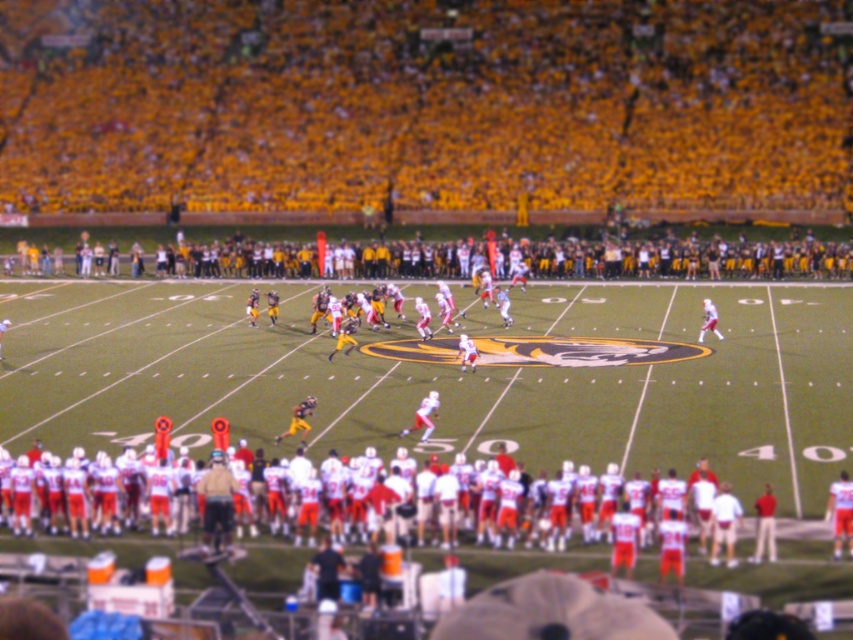
You are a photographer standing near the camera at upper right. You want to capture a close shot of the yellow fabric seats at upper center where the fans are cheering. Given that your camera has a maximum zoom range of 200 feet, will you be able to clearly capture the seats?

The yellow fabric seats at upper center and camera are 241.56 feet apart from each other. Since the maximum zoom range of your camera is 200 feet, you will not be able to clearly capture the seats as the distance exceeds the camera capabilities.

You are a photographer standing at the center of the field during the football game. You want to capture a photo of the point at coordinates point (125, 150). Your camera has a maximum focus range of 80 meters. Will you be able to focus on that point?

The point (125, 150) is 88.09 meters away from the viewer. Since the camera can only focus up to 80 meters, it will not be able to focus on the point (125, 150).

You are a photographer trying to capture a photo of the white fabric football team at lower center without any obstructions. Are the yellow fabric seats at upper center blocking your view of them?

The yellow fabric seats at upper center are positioned over the white fabric football team at lower center, so they are blocking the view of the white fabric football team at lower center.